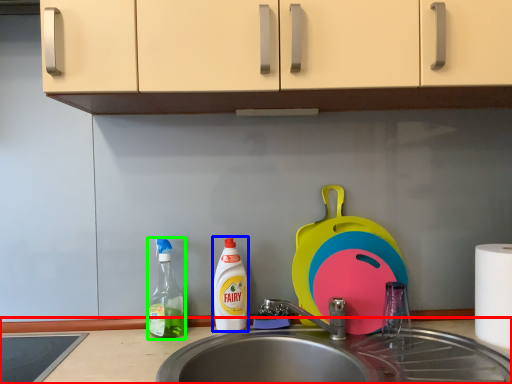
Question: Which object is the farthest from countertop (highlighted by a red box)? Choose among these: cleaning product (highlighted by a blue box) or bottle (highlighted by a green box).

Choices:
 (A) cleaning product
 (B) bottle

Answer: (A)